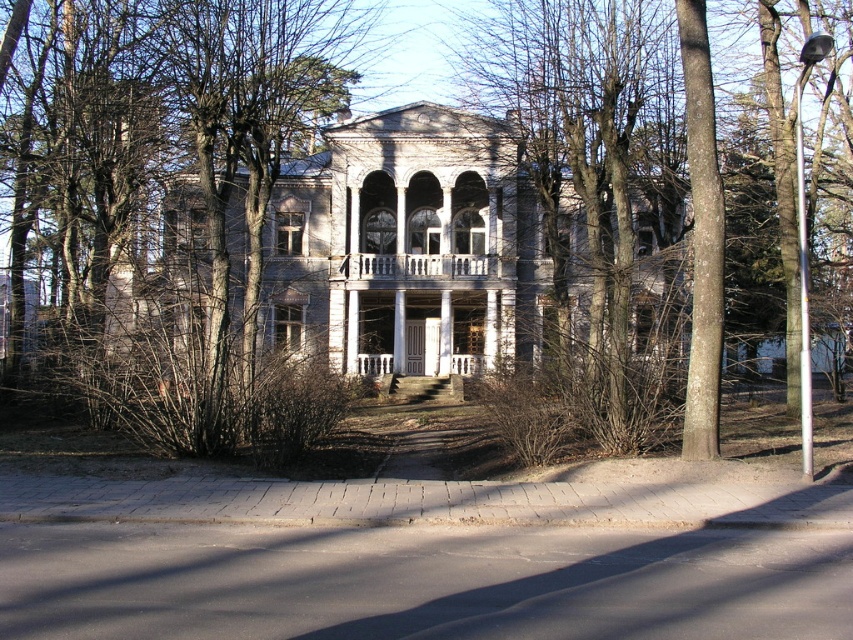
Looking at this image, you are a visitor approaching the gray stone mansion at center and the white painted wood porch at center. The path you are on is 5 meters wide. Can you walk straight towards the mansion without deviating around the porch?

The distance between the gray stone mansion at center and white painted wood porch at center is 7.42 meters. Since the path is 5 meters wide, you can walk straight towards the mansion without needing to detour around the porch as there is sufficient space between them.